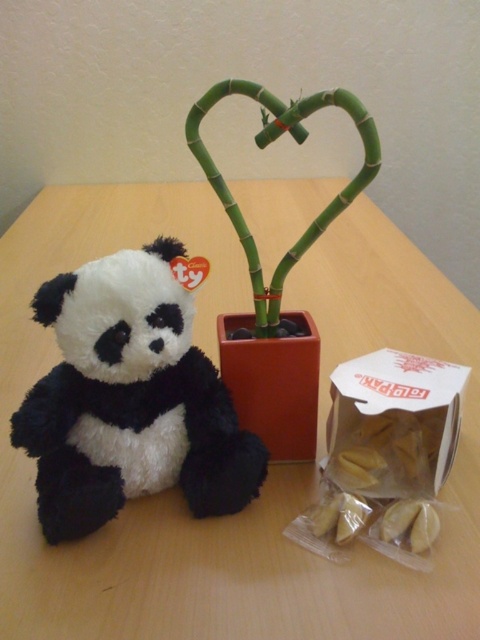
Is wooden table at center positioned at the back of green bamboo at center?

No, wooden table at center is closer to the viewer.

Does wooden table at center appear under green bamboo at center?

Yes.

Is point (367, 616) positioned behind point (369, 154)?

No, it is in front of (369, 154).

Where is `wooden table at center`? This screenshot has height=640, width=480. wooden table at center is located at coordinates (268, 467).

Who is more forward, (78, 477) or (337, 92)?

Point (337, 92)

In the scene shown: Is black plush panda at left further to the viewer compared to green bamboo at center?

Yes, it is behind green bamboo at center.

Describe the element at coordinates (130, 400) in the screenshot. I see `black plush panda at left` at that location.

Identify the location of black plush panda at left. This screenshot has width=480, height=640. 130,400.

Does white paper fortune cookies at lower right appear on the left side of green bamboo at center?

Incorrect, white paper fortune cookies at lower right is not on the left side of green bamboo at center.

Which of these two, white paper fortune cookies at lower right or green bamboo at center, stands taller?

green bamboo at center is taller.

Is point (432, 468) positioned in front of point (252, 276)?

Yes, point (432, 468) is in front of point (252, 276).

At what (x,y) coordinates should I click in order to perform the action: click on white paper fortune cookies at lower right. Please return your answer as a coordinate pair (x, y). This screenshot has height=640, width=480. Looking at the image, I should click on (396, 420).